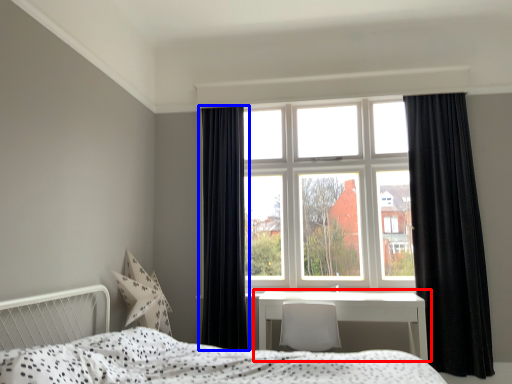
Question: Among these objects, which one is farthest to the camera, table (highlighted by a red box) or curtain (highlighted by a blue box)?

Choices:
 (A) table
 (B) curtain

Answer: (B)